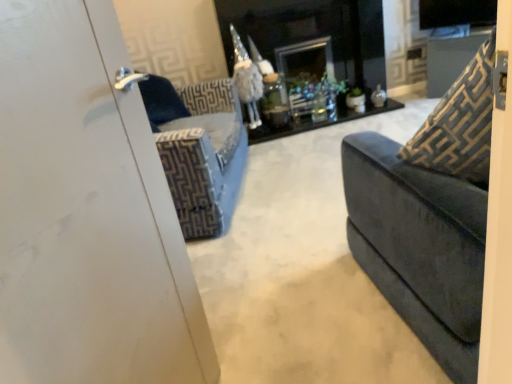
Question: Should I look upward or downward to see gold-patterned fabric at right?

Choices:
 (A) down
 (B) up

Answer: (B)

Question: Is black glossy fireplace at center in front of gold-patterned fabric at right?

Choices:
 (A) no
 (B) yes

Answer: (A)

Question: Is black glossy fireplace at center thinner than gold-patterned fabric at right?

Choices:
 (A) yes
 (B) no

Answer: (B)

Question: Considering the relative positions of black glossy fireplace at center and gold-patterned fabric at right in the image provided, is black glossy fireplace at center to the left of gold-patterned fabric at right from the viewer's perspective?

Choices:
 (A) no
 (B) yes

Answer: (B)

Question: From a real-world perspective, is black glossy fireplace at center physically below gold-patterned fabric at right?

Choices:
 (A) no
 (B) yes

Answer: (B)

Question: Is black glossy fireplace at center behind gold-patterned fabric at right?

Choices:
 (A) yes
 (B) no

Answer: (A)

Question: Does black glossy fireplace at center have a lesser height compared to gold-patterned fabric at right?

Choices:
 (A) yes
 (B) no

Answer: (B)

Question: Can you confirm if gold-patterned fabric at right is wider than black glossy fireplace at center?

Choices:
 (A) yes
 (B) no

Answer: (B)

Question: Is gold-patterned fabric at right at the left side of black glossy fireplace at center?

Choices:
 (A) no
 (B) yes

Answer: (A)

Question: Is black glossy fireplace at center inside gold-patterned fabric at right?

Choices:
 (A) yes
 (B) no

Answer: (B)

Question: From a real-world perspective, is gold-patterned fabric at right located higher than black glossy fireplace at center?

Choices:
 (A) yes
 (B) no

Answer: (A)

Question: Is gold-patterned fabric at right facing towards black glossy fireplace at center?

Choices:
 (A) no
 (B) yes

Answer: (B)

Question: Is gold-patterned fabric at right positioned behind black glossy fireplace at center?

Choices:
 (A) yes
 (B) no

Answer: (B)

Question: Is black glossy fireplace at center to the left or to the right of gold-patterned fabric at right in the image?

Choices:
 (A) left
 (B) right

Answer: (A)